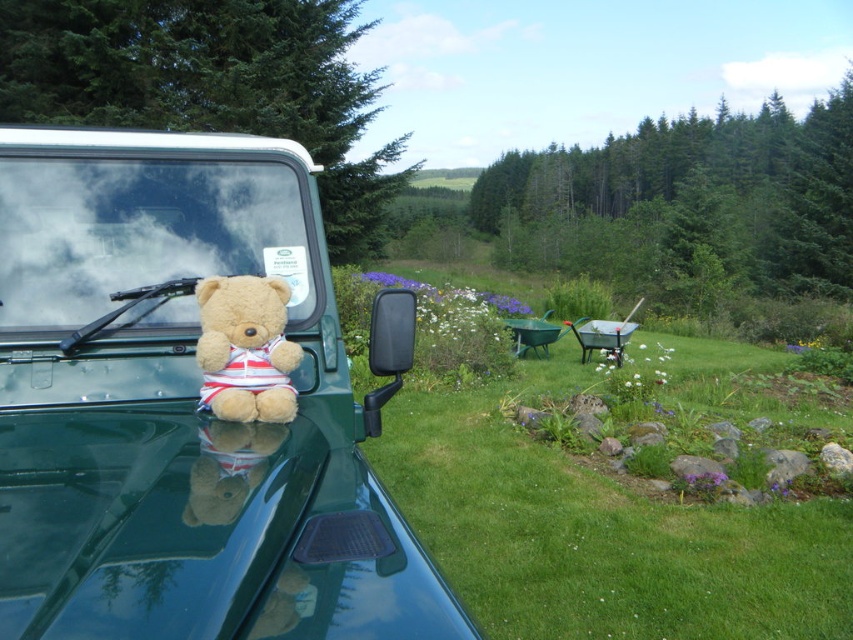
You are a delivery drone that needs to fly over the green matte car at center and the transparent glass windshield at upper center. Which object should you avoid flying too close to due to its larger size?

The green matte car at center is bigger than the transparent glass windshield at upper center, so you should avoid flying too close to the green matte car at center because of its larger size.

You are a delivery drone that needs to drop off a package to the fuzzy beige teddy bear at center. The drone can only hover 5 inches above the green matte car at center. Can the drone safely drop the package without hitting the car?

The distance between the green matte car at center and the fuzzy beige teddy bear at center is 8.06 inches. Since the drone can hover 5 inches above the car, it would still be 3.06 inches away from the teddy bear, so the package can be safely dropped.